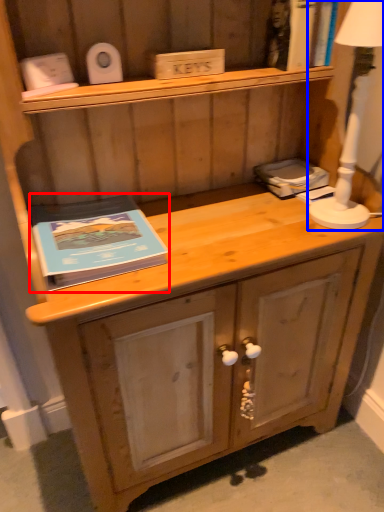
Question: Which object appears farthest to the camera in this image, paperback book (highlighted by a red box) or bedside lamp (highlighted by a blue box)?

Choices:
 (A) paperback book
 (B) bedside lamp

Answer: (A)